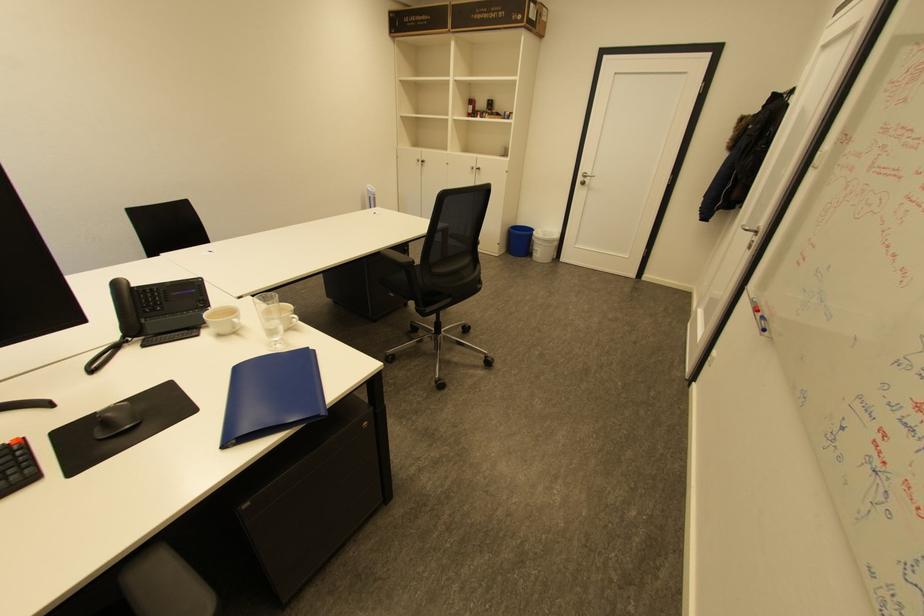
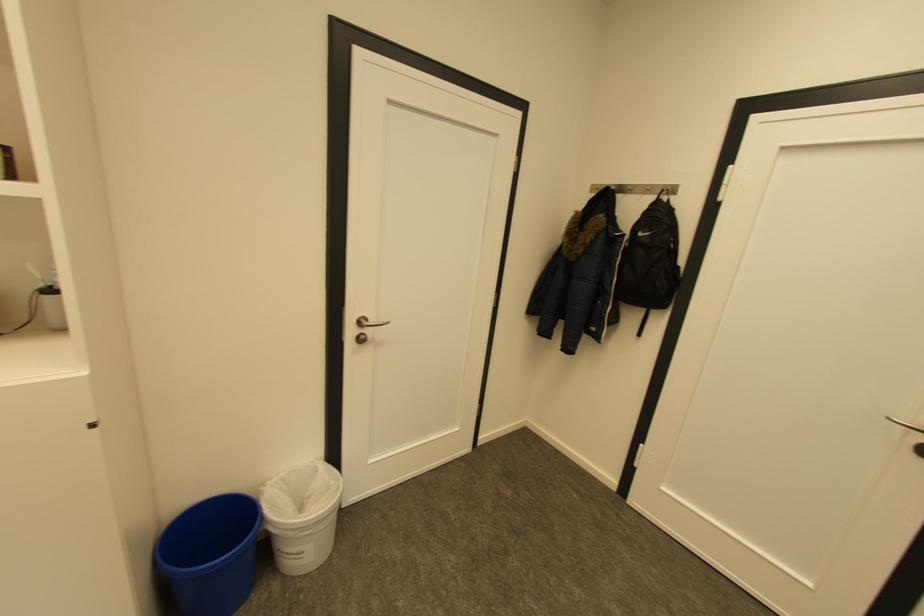
In the second image, find the point that corresponds to [551,232] in the first image.

(289, 477)